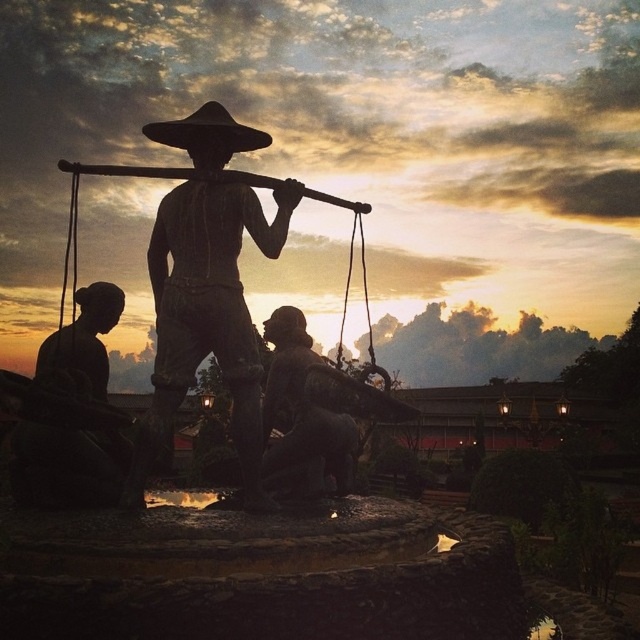
Question: Which of the following is the farthest from the observer?

Choices:
 (A) (234, 122)
 (B) (204, 321)

Answer: (A)

Question: Which object appears farthest from the camera in this image?

Choices:
 (A) matte bronze statue at center
 (B) black matte cowboy hat at upper center

Answer: (B)

Question: Does matte bronze statue at center appear on the left side of black matte cowboy hat at upper center?

Choices:
 (A) no
 (B) yes

Answer: (B)

Question: Is matte bronze statue at center above black matte cowboy hat at upper center?

Choices:
 (A) no
 (B) yes

Answer: (A)

Question: Is matte bronze statue at center behind black matte cowboy hat at upper center?

Choices:
 (A) no
 (B) yes

Answer: (A)

Question: Which point is closer to the camera taking this photo?

Choices:
 (A) (236, 260)
 (B) (198, 129)

Answer: (A)